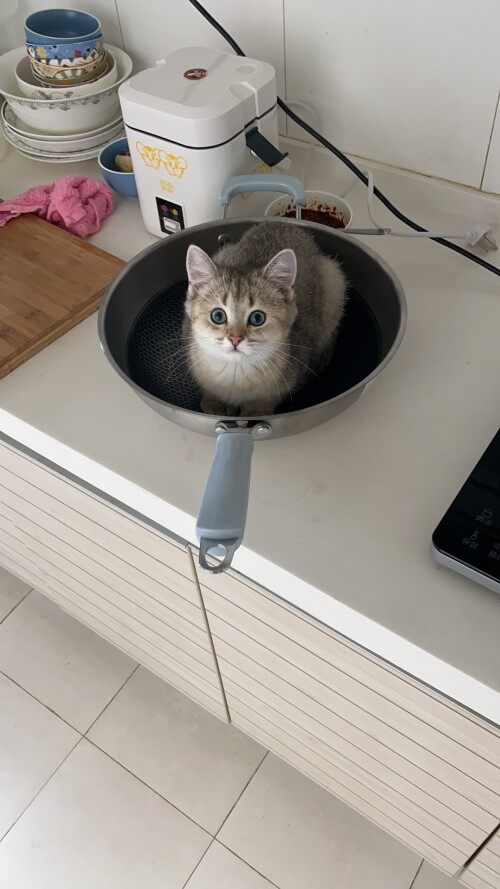
The image size is (500, 889). What are the coordinates of `frying pan handle` in the screenshot? It's located at [227, 473].